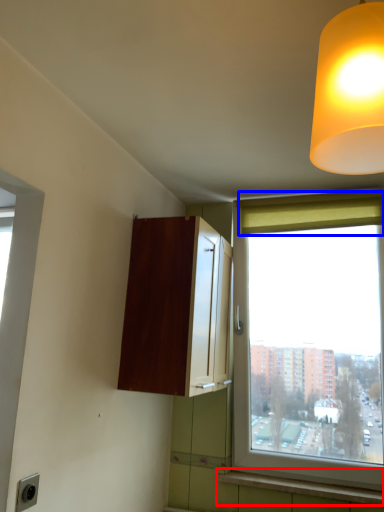
Question: Which object is further to the camera taking this photo, window sill (highlighted by a red box) or curtain (highlighted by a blue box)?

Choices:
 (A) window sill
 (B) curtain

Answer: (B)